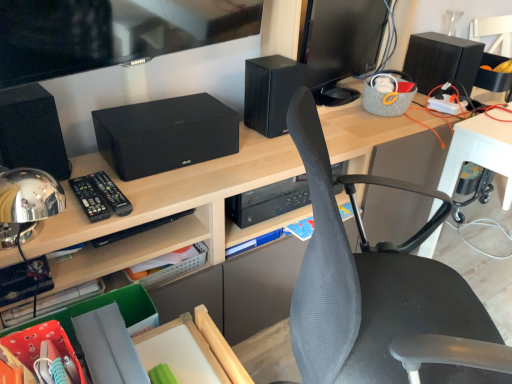
Question: Is black matte speaker at center, the second speaker from the right, bigger than black plastic remote at left, the second control positioned from the right?

Choices:
 (A) yes
 (B) no

Answer: (A)

Question: Is black matte speaker at center, positioned as the 2th speaker in back-to-front order, positioned beyond the bounds of black plastic remote at left, which appears as the 1th control when viewed from the left?

Choices:
 (A) no
 (B) yes

Answer: (B)

Question: Is black matte speaker at center, the second speaker from the right, taller than black plastic remote at left, which appears as the 1th control when viewed from the left?

Choices:
 (A) yes
 (B) no

Answer: (A)

Question: Is black matte speaker at center, positioned as the 2th speaker in back-to-front order, closer to the viewer compared to black plastic remote at left, the second control positioned from the right?

Choices:
 (A) no
 (B) yes

Answer: (A)

Question: Could you tell me if black matte speaker at center, positioned as the 2th speaker in back-to-front order, is facing black plastic remote at left, the second control positioned from the right?

Choices:
 (A) no
 (B) yes

Answer: (A)

Question: From a real-world perspective, relative to black plastic remote at left, which appears as the 1th control when viewed from the left, is black matte speaker at upper left, positioned as the third speaker in back-to-front order, vertically above or below?

Choices:
 (A) below
 (B) above

Answer: (B)

Question: In the image, is black matte speaker at upper left, which appears as the first speaker when viewed from the left, positioned in front of or behind black plastic remote at left, which appears as the 1th control when viewed from the left?

Choices:
 (A) front
 (B) behind

Answer: (A)

Question: Looking at the image, does black matte speaker at upper left, positioned as the third speaker in back-to-front order, seem bigger or smaller compared to black plastic remote at left, the second control positioned from the right?

Choices:
 (A) small
 (B) big

Answer: (B)

Question: Looking at their shapes, would you say black matte speaker at upper left, acting as the 1th speaker starting from the front, is wider or thinner than black plastic remote at left, which appears as the 1th control when viewed from the left?

Choices:
 (A) thin
 (B) wide

Answer: (A)

Question: Does point (374, 61) appear closer or farther from the camera than point (442, 59)?

Choices:
 (A) farther
 (B) closer

Answer: (A)

Question: From a real-world perspective, relative to black matte speaker at upper right, placed as the third speaker when sorted from front to back, is black glossy monitor at upper right vertically above or below?

Choices:
 (A) above
 (B) below

Answer: (A)

Question: Would you say black glossy monitor at upper right is to the left or to the right of black matte speaker at upper right, placed as the first speaker when sorted from back to front, in the picture?

Choices:
 (A) left
 (B) right

Answer: (A)

Question: In the image, is black glossy monitor at upper right positioned in front of or behind black matte speaker at upper right, placed as the first speaker when sorted from back to front?

Choices:
 (A) behind
 (B) front

Answer: (B)

Question: Do you think black plastic remote at center, positioned as the first control in right-to-left order, is within gray mesh chair at center, or outside of it?

Choices:
 (A) outside
 (B) inside

Answer: (A)

Question: Considering the positions of black plastic remote at center, positioned as the first control in right-to-left order, and gray mesh chair at center in the image, is black plastic remote at center, positioned as the first control in right-to-left order, bigger or smaller than gray mesh chair at center?

Choices:
 (A) big
 (B) small

Answer: (B)